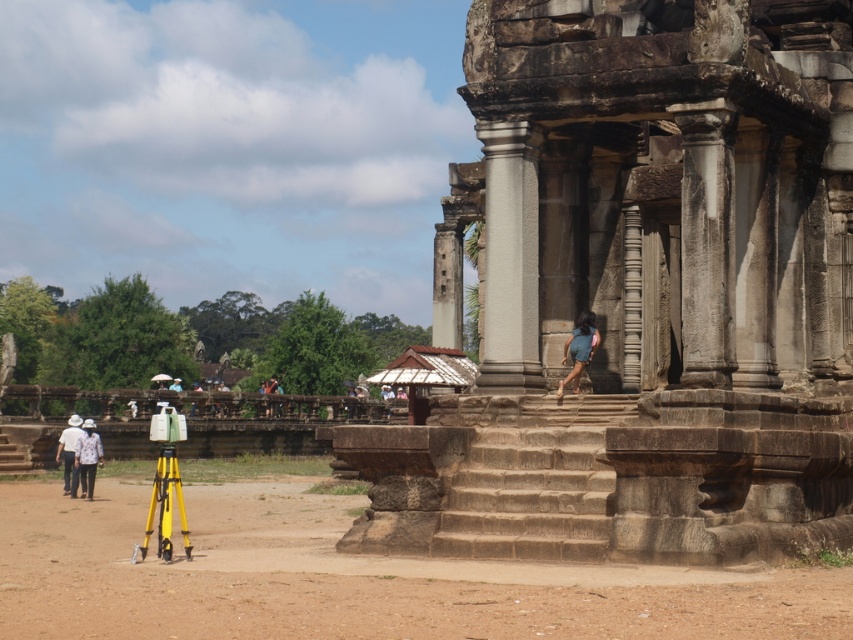
Does blue denim shorts at center have a greater height compared to white fabric person at lower left?

In fact, blue denim shorts at center may be shorter than white fabric person at lower left.

Does blue denim shorts at center appear under white fabric person at lower left?

No.

Is point (589, 316) more distant than point (83, 445)?

No, it is in front of (83, 445).

Where is `blue denim shorts at center`? blue denim shorts at center is located at coordinates (578, 349).

Is gray stone ruins at center smaller than white fabric hat at lower left?

Incorrect, gray stone ruins at center is not smaller in size than white fabric hat at lower left.

Who is positioned more to the left, gray stone ruins at center or white fabric hat at lower left?

white fabric hat at lower left

Image resolution: width=853 pixels, height=640 pixels. Identify the location of gray stone ruins at center. (x=641, y=291).

Can you confirm if white stone column at center is positioned to the left of white fabric hat at lower left?

Incorrect, white stone column at center is not on the left side of white fabric hat at lower left.

Does white stone column at center have a greater width compared to white fabric hat at lower left?

No, white stone column at center is not wider than white fabric hat at lower left.

This screenshot has height=640, width=853. Identify the location of white stone column at center. (509, 259).

Where is `white stone column at center`? white stone column at center is located at coordinates click(x=509, y=259).